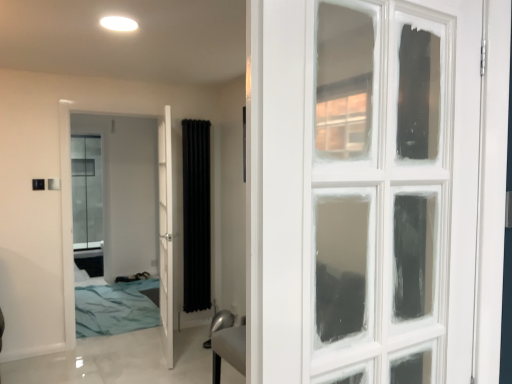
Question: Is black fabric radiator at center wider than white glossy door at center, acting as the second door starting from the right?

Choices:
 (A) yes
 (B) no

Answer: (A)

Question: Considering the relative sizes of black fabric radiator at center and white glossy door at center, acting as the second door starting from the right, in the image provided, is black fabric radiator at center shorter than white glossy door at center, acting as the second door starting from the right,?

Choices:
 (A) yes
 (B) no

Answer: (A)

Question: From a real-world perspective, is black fabric radiator at center on white glossy door at center, acting as the second door starting from the right?

Choices:
 (A) no
 (B) yes

Answer: (B)

Question: Is white glossy door at center, acting as the second door starting from the right, a part of black fabric radiator at center?

Choices:
 (A) yes
 (B) no

Answer: (B)

Question: Considering the relative positions of black fabric radiator at center and white glossy door at center, the first door when ordered from left to right, in the image provided, is black fabric radiator at center to the left of white glossy door at center, the first door when ordered from left to right, from the viewer's perspective?

Choices:
 (A) yes
 (B) no

Answer: (B)

Question: Considering the relative sizes of black fabric radiator at center and white glossy door at center, acting as the second door starting from the right, in the image provided, is black fabric radiator at center smaller than white glossy door at center, acting as the second door starting from the right,?

Choices:
 (A) yes
 (B) no

Answer: (A)

Question: From a real-world perspective, is white glossy door at center, acting as the second door starting from the right, physically below black fabric radiator at center?

Choices:
 (A) yes
 (B) no

Answer: (A)

Question: Considering the relative sizes of white glossy door at center, acting as the second door starting from the right, and black fabric radiator at center in the image provided, is white glossy door at center, acting as the second door starting from the right, wider than black fabric radiator at center?

Choices:
 (A) no
 (B) yes

Answer: (A)

Question: Is white glossy door at center, the first door when ordered from left to right, closer to the viewer compared to black fabric radiator at center?

Choices:
 (A) no
 (B) yes

Answer: (B)

Question: From the image's perspective, is white glossy door at center, acting as the second door starting from the right, on top of black fabric radiator at center?

Choices:
 (A) no
 (B) yes

Answer: (A)

Question: Does white glossy door at center, acting as the second door starting from the right, have a lesser width compared to black fabric radiator at center?

Choices:
 (A) yes
 (B) no

Answer: (A)

Question: Is white glossy door at center, the first door when ordered from left to right, next to black fabric radiator at center?

Choices:
 (A) yes
 (B) no

Answer: (B)

Question: Does white glossy door at center, which ranks as the 1th door in right-to-left order, have a lesser height compared to white glossy door at center, acting as the second door starting from the right?

Choices:
 (A) yes
 (B) no

Answer: (A)